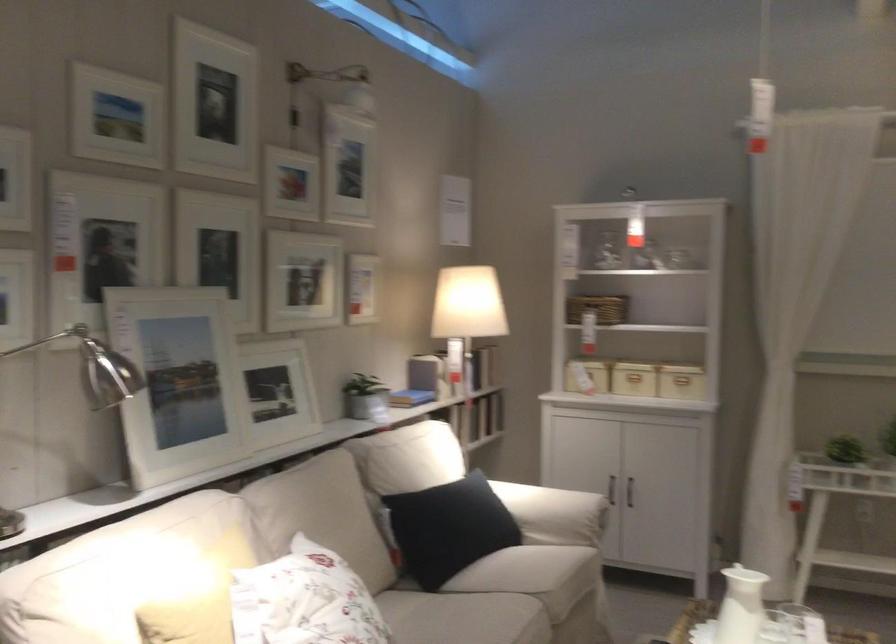
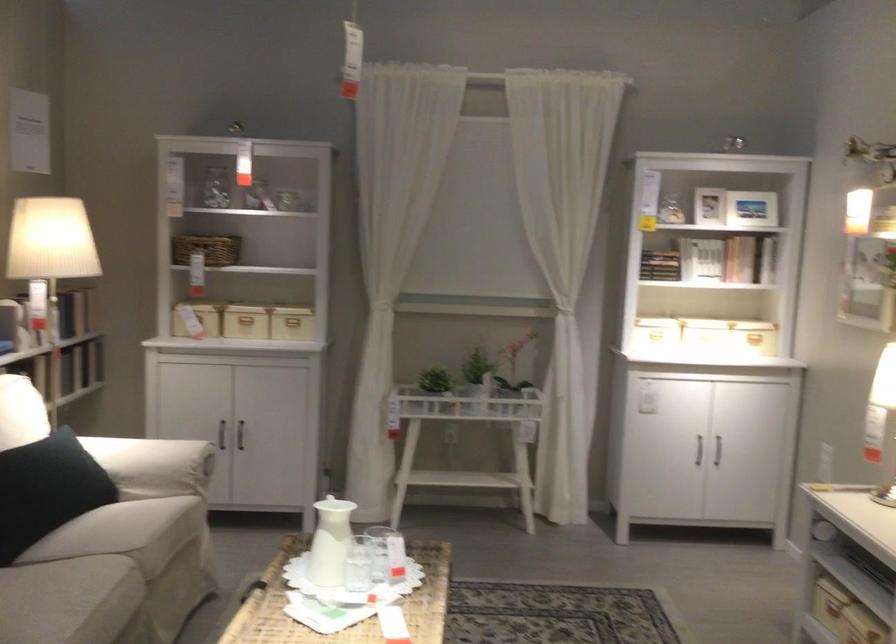
Question: What movement of the cameraman would produce the second image?

Choices:
 (A) Left
 (B) Right
 (C) Forward
 (D) Backward

Answer: (B)